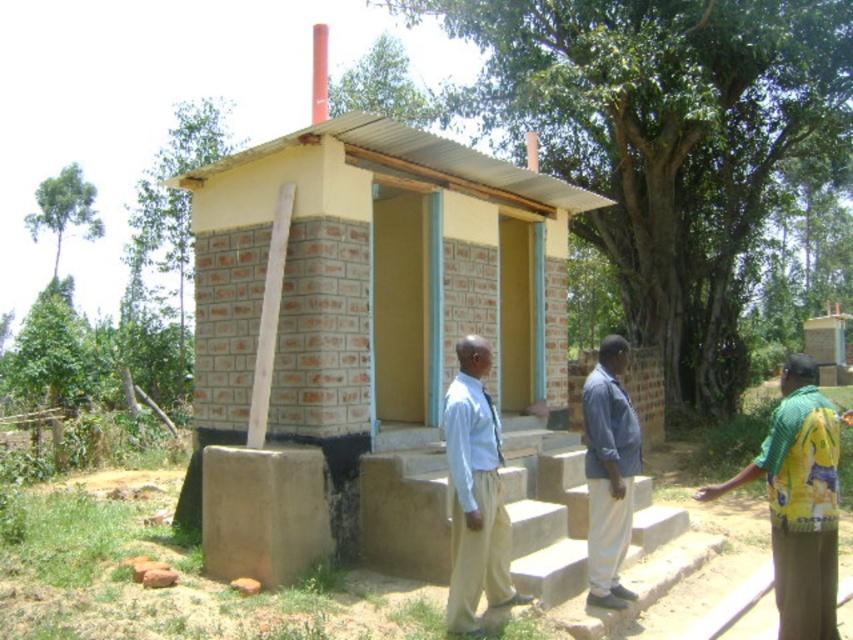
Question: Can you confirm if light blue shirt at center is positioned to the right of blue fabric shirt at center?

Choices:
 (A) no
 (B) yes

Answer: (A)

Question: Is light blue shirt at center smaller than blue fabric shirt at center?

Choices:
 (A) yes
 (B) no

Answer: (B)

Question: Can you confirm if brown concrete stairs at center is thinner than green printed shirt at right?

Choices:
 (A) yes
 (B) no

Answer: (A)

Question: Which of the following is the farthest from the observer?

Choices:
 (A) green printed shirt at right
 (B) light blue shirt at center

Answer: (B)

Question: Among these points, which one is farthest from the camera?

Choices:
 (A) (550, 477)
 (B) (453, 460)
 (C) (598, 484)
 (D) (796, 392)

Answer: (A)

Question: Which point is closer to the camera?

Choices:
 (A) (474, 602)
 (B) (630, 499)

Answer: (A)